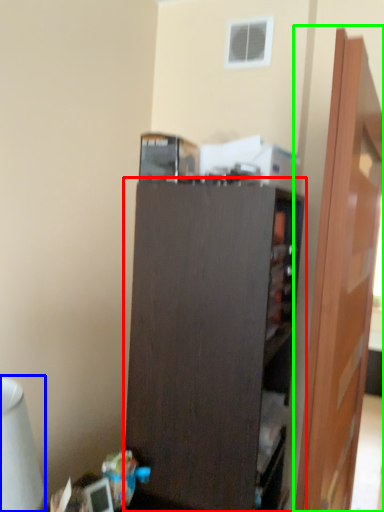
Question: Considering the real-world distances, which object is closest to cupboard (highlighted by a red box)? table lamp (highlighted by a blue box) or door (highlighted by a green box).

Choices:
 (A) table lamp
 (B) door

Answer: (B)